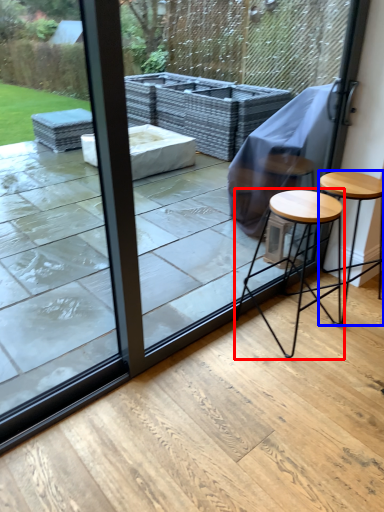
Question: Which point is closer to the camera, stool (highlighted by a red box) or stool (highlighted by a blue box)?

Choices:
 (A) stool
 (B) stool

Answer: (A)